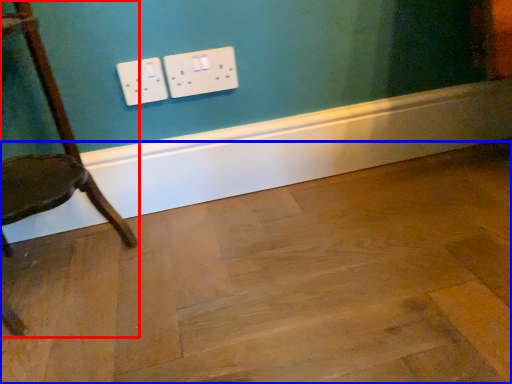
Question: Among these objects, which one is nearest to the camera, chair (highlighted by a red box) or plywood (highlighted by a blue box)?

Choices:
 (A) chair
 (B) plywood

Answer: (B)